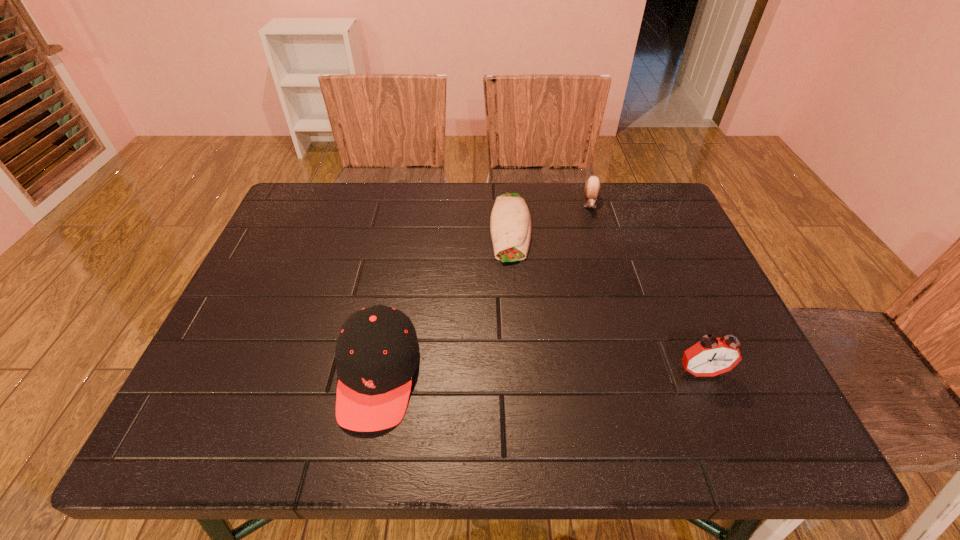
You are a GUI agent. You are given a task and a screenshot of the screen. Output one action in this format:
    pyautogui.click(x=<x>, y=<y>)
    Task: Click on the blank region between the second object from left to right and the escargot
    Image resolution: width=960 pixels, height=540 pixels.
    Given the screenshot: What is the action you would take?
    pyautogui.click(x=551, y=215)

Image resolution: width=960 pixels, height=540 pixels. Identify the location of empty space between the leftmost object and the alarm clock. (540, 374).

The height and width of the screenshot is (540, 960). In order to click on free space between the escargot and the second object from left to right in this screenshot , I will do `click(551, 215)`.

Where is `free area in between the cap and the burrito`? This screenshot has height=540, width=960. free area in between the cap and the burrito is located at coordinates (444, 301).

Locate which object is the closest to the second object from left to right. Please provide its 2D coordinates. Your answer should be formatted as a tuple, i.e. [(x, y)], where the tuple contains the x and y coordinates of a point satisfying the conditions above.

[(592, 187)]

Where is `object that is the closest to the escargot`? The width and height of the screenshot is (960, 540). object that is the closest to the escargot is located at coordinates (510, 223).